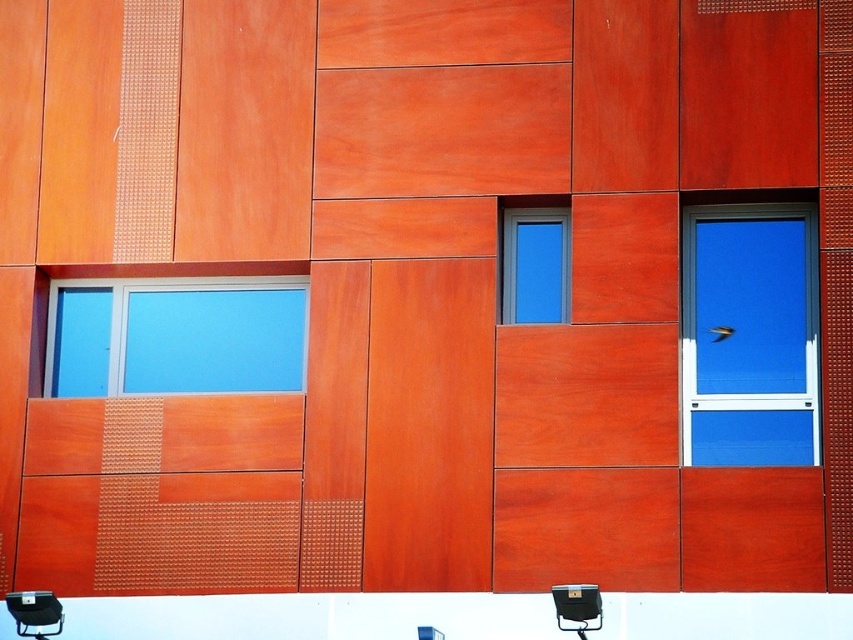
Consider the image. Which is above, blue glass window at center right or matte blue glass window at center?

matte blue glass window at center is above.

Does blue glass window at center right have a lesser height compared to matte blue glass window at center?

No.

I want to click on blue glass window at center right, so click(x=749, y=336).

Who is higher up, blue glass window at center right or black plastic chair at lower left?

Positioned higher is blue glass window at center right.

Does point (761, 394) come farther from viewer compared to point (59, 621)?

That is True.

This screenshot has height=640, width=853. Identify the location of blue glass window at center right. (749, 336).

The width and height of the screenshot is (853, 640). What are the coordinates of `black plastic chair at lower left` in the screenshot? It's located at (33, 612).

Does black plastic chair at lower left appear on the left side of metallic black chair at lower right?

Yes, black plastic chair at lower left is to the left of metallic black chair at lower right.

Between point (20, 624) and point (573, 586), which one is positioned behind?

The point (20, 624) is more distant.

Locate an element on the screen. The image size is (853, 640). black plastic chair at lower left is located at coordinates (33, 612).